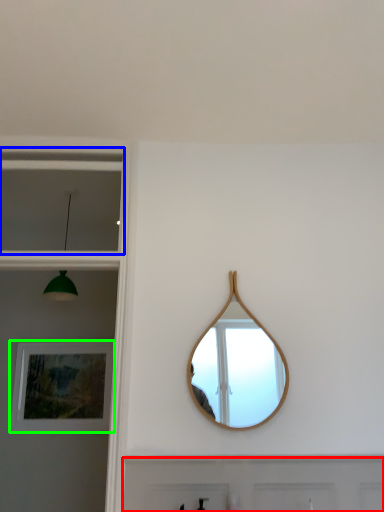
Question: Which is nearer to the door (highlighted by a red box)? window (highlighted by a blue box) or picture frame (highlighted by a green box).

Choices:
 (A) window
 (B) picture frame

Answer: (B)